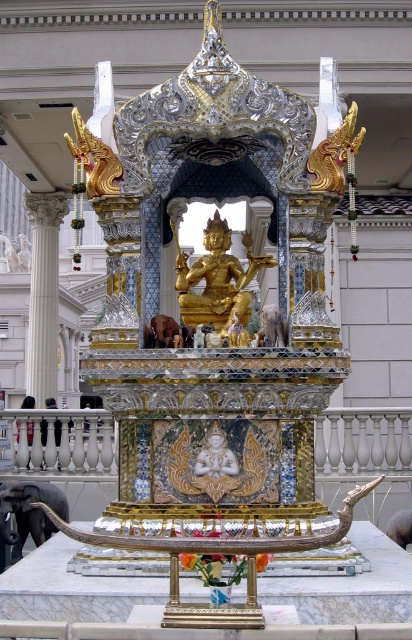
Question: Is gold polished statue at center smaller than white marble column at left?

Choices:
 (A) yes
 (B) no

Answer: (A)

Question: Which object appears closest to the camera in this image?

Choices:
 (A) white marble column at left
 (B) gold polished statue at center

Answer: (B)

Question: Which object is farther from the camera taking this photo?

Choices:
 (A) white marble column at left
 (B) gold polished statue at center

Answer: (A)

Question: Which point is farther from the camera taking this photo?

Choices:
 (A) (240, 298)
 (B) (32, 266)

Answer: (B)

Question: Can you confirm if gold polished statue at center is positioned above white marble column at left?

Choices:
 (A) no
 (B) yes

Answer: (A)

Question: Is gold polished statue at center smaller than white marble column at left?

Choices:
 (A) yes
 (B) no

Answer: (A)